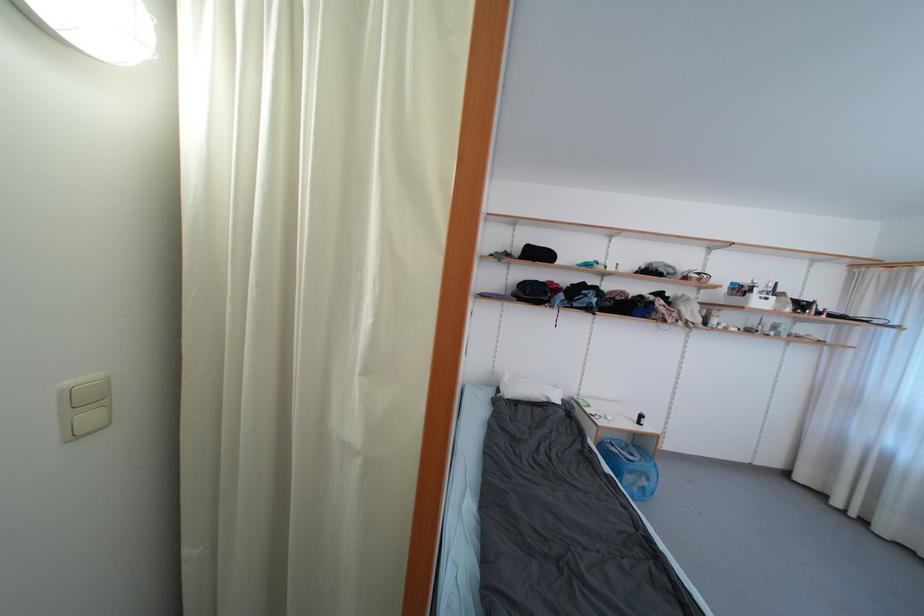
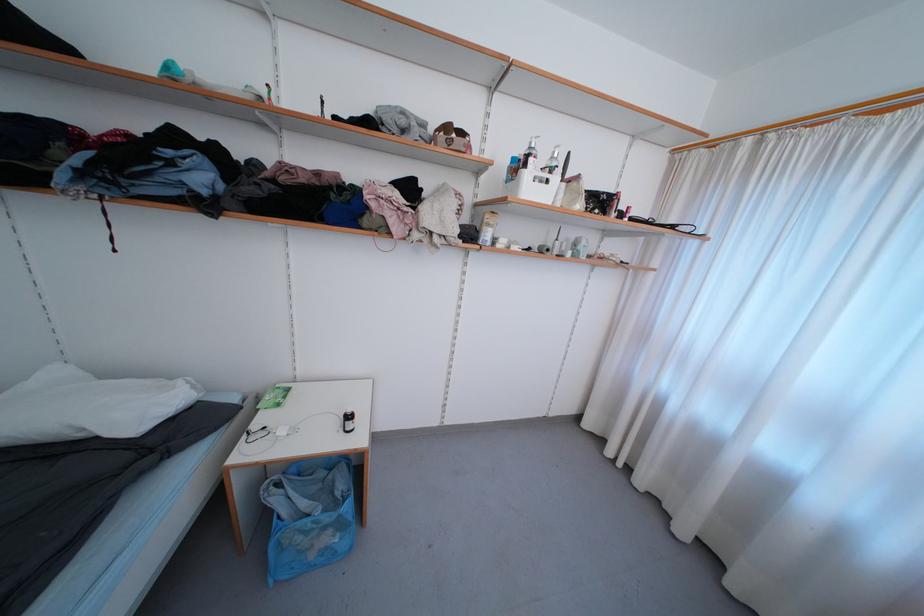
Locate, in the second image, the point that corresponds to pixel 755 293 in the first image.

(529, 168)